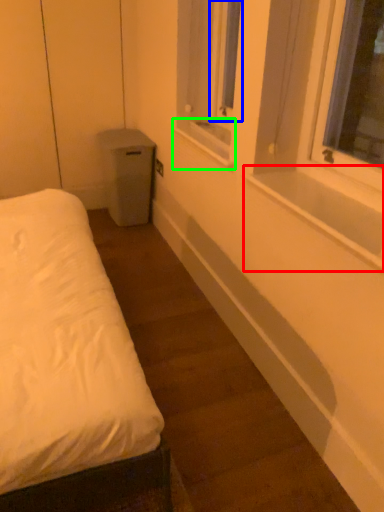
Question: Considering the real-world distances, which object is farthest from window sill (highlighted by a red box)? window screen (highlighted by a blue box) or window sill (highlighted by a green box)?

Choices:
 (A) window screen
 (B) window sill

Answer: (A)